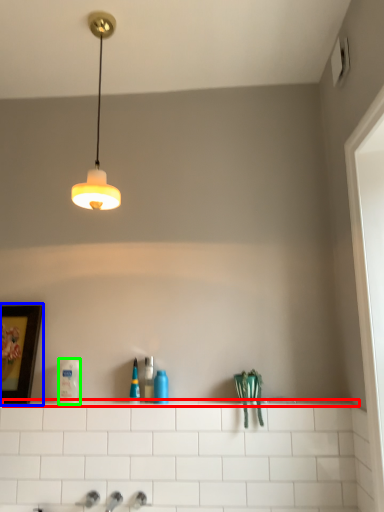
Question: Based on their relative distances, which object is nearer to ledge (highlighted by a red box)? Choose from picture frame (highlighted by a blue box) and toiletry (highlighted by a green box).

Choices:
 (A) picture frame
 (B) toiletry

Answer: (B)